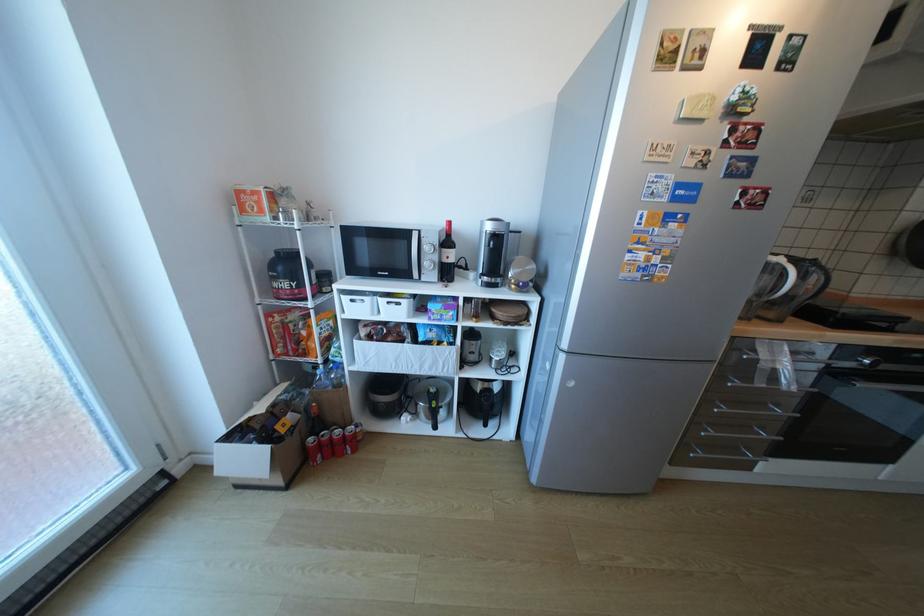
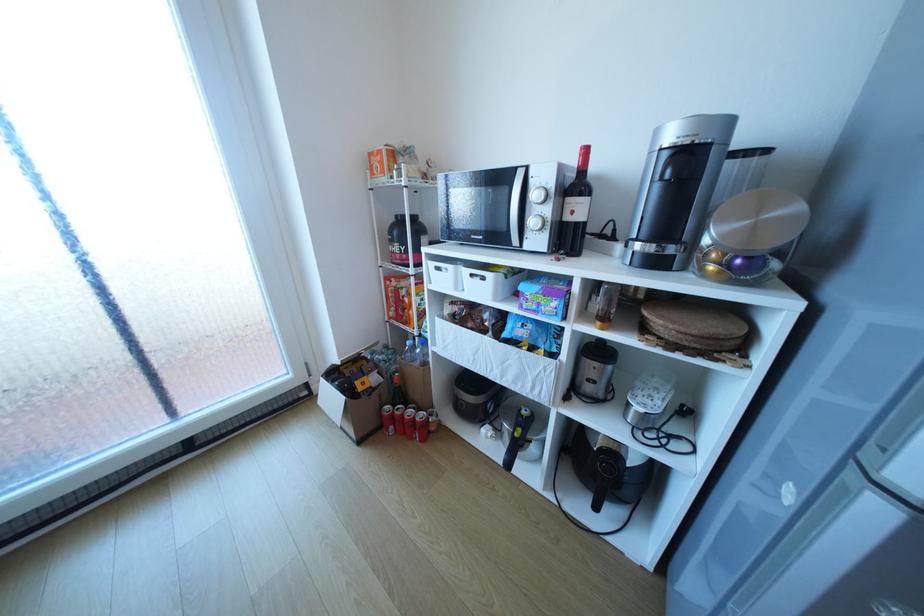
The point at (351,455) is marked in the first image. Where is the corresponding point in the second image?

(420, 438)